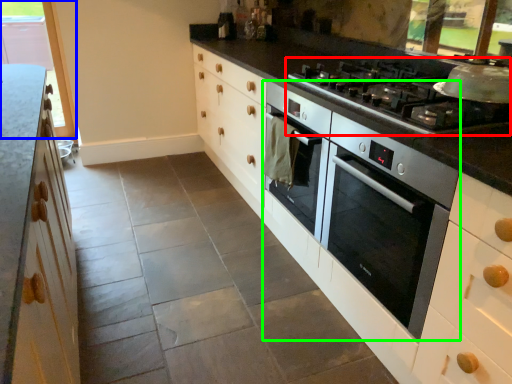
Question: Which object is the closest to the gas stove (highlighted by a red box)? Choose among these: window (highlighted by a blue box) or home appliance (highlighted by a green box).

Choices:
 (A) window
 (B) home appliance

Answer: (B)